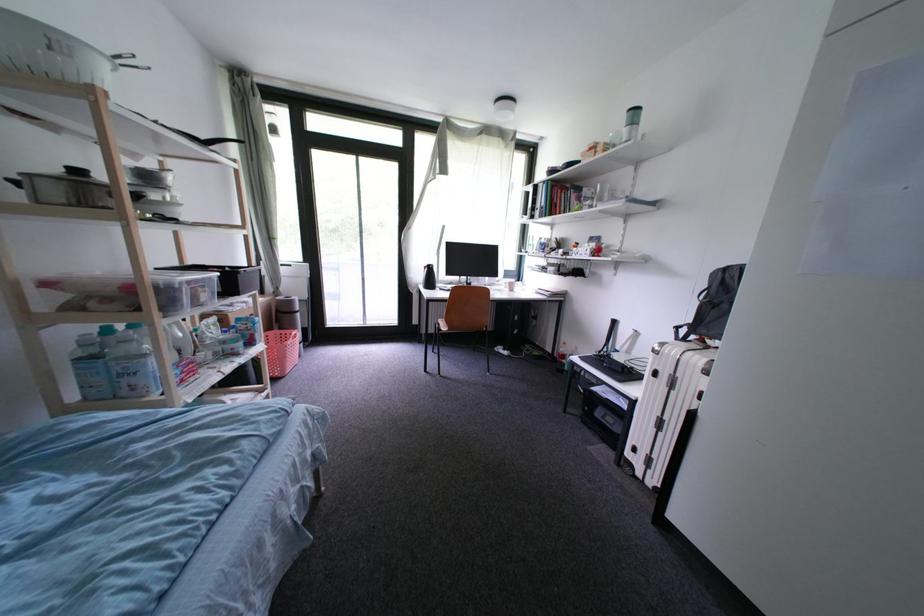
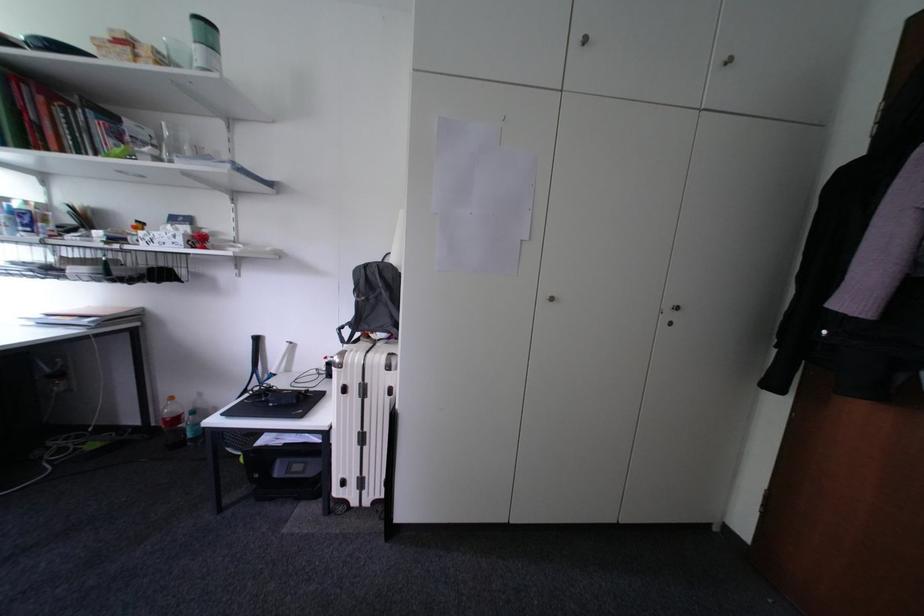
Locate, in the second image, the point that corresponds to point 569,352 in the first image.

(176, 413)